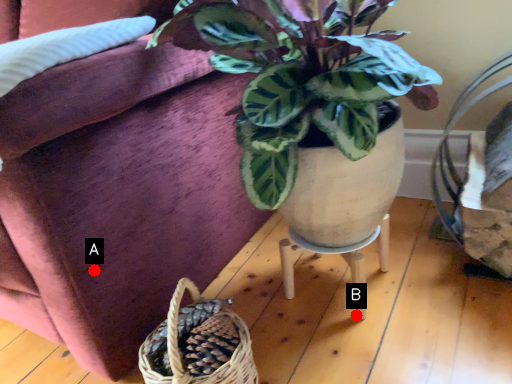
Question: Two points are circled on the image, labeled by A and B beside each circle. Which point appears farthest from the camera in this image?

Choices:
 (A) A is further
 (B) B is further

Answer: (B)